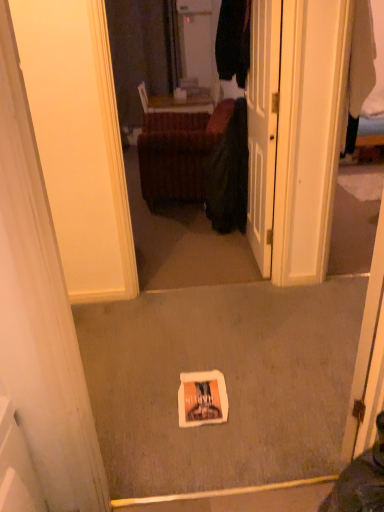
Image resolution: width=384 pixels, height=512 pixels. Find the location of `free space underneath white glossy door at center (from a real-world perspective)`. free space underneath white glossy door at center (from a real-world perspective) is located at coordinates (247, 247).